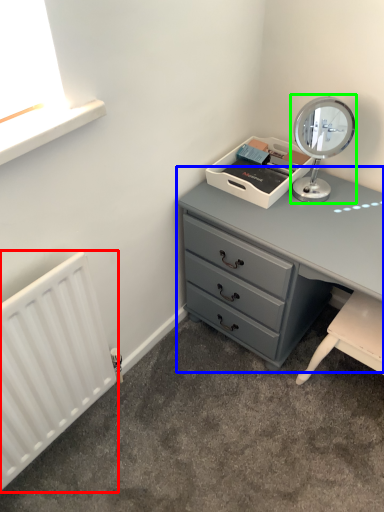
Question: Based on their relative distances, which object is farther from radiator (highlighted by a red box)? Choose from chest of drawers (highlighted by a blue box) and table lamp (highlighted by a green box).

Choices:
 (A) chest of drawers
 (B) table lamp

Answer: (B)